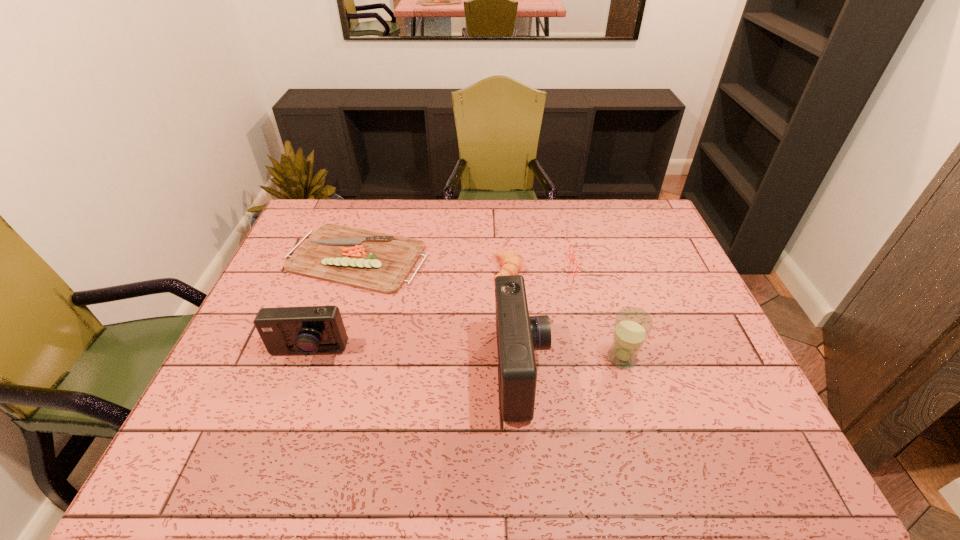
Please point a free position for a camera on the right. Please provide its 2D coordinates. Your answer should be formatted as a tuple, i.e. [(x, y)], where the tuple contains the x and y coordinates of a point satisfying the conditions above.

[(752, 392)]